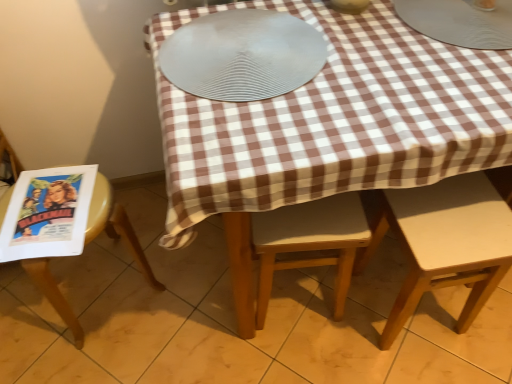
Where is `vacant area situated to the left side of light brown wooden chair at center, arranged as the second chair when viewed from the right`? This screenshot has height=384, width=512. vacant area situated to the left side of light brown wooden chair at center, arranged as the second chair when viewed from the right is located at coordinates (208, 299).